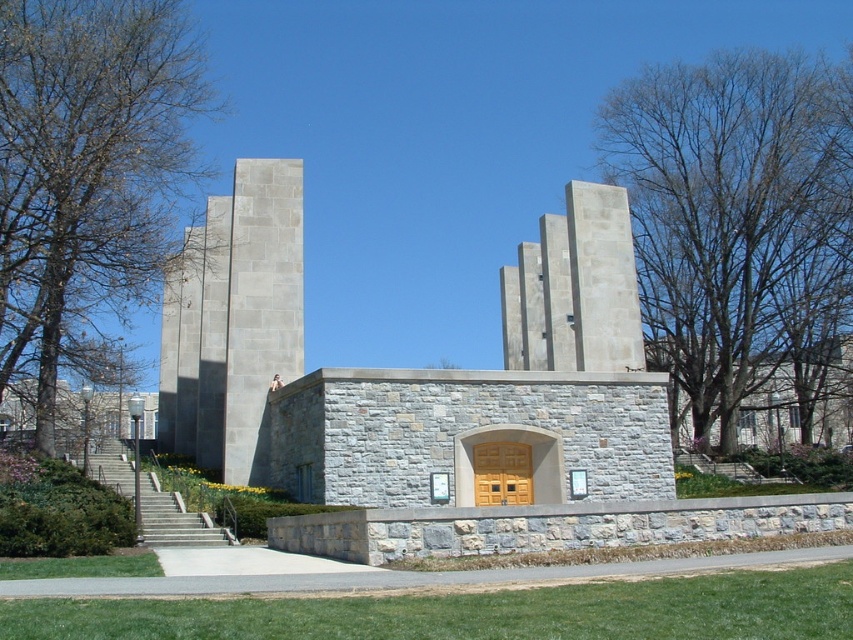
Question: Can you confirm if bare branches at right is wider than light beige stone tower at center?

Choices:
 (A) yes
 (B) no

Answer: (A)

Question: Is bare branches at right thinner than light beige stone tower at center?

Choices:
 (A) yes
 (B) no

Answer: (B)

Question: Which object is closer to the camera taking this photo?

Choices:
 (A) gray stone tower at center
 (B) light beige stone tower at center
 (C) brown leafy tree at upper left

Answer: (A)

Question: Which point appears closest to the camera in this image?

Choices:
 (A) (90, 93)
 (B) (267, 310)
 (C) (514, 316)
 (D) (685, 269)

Answer: (B)

Question: Which object is the closest to the light beige stone tower at center?

Choices:
 (A) gray stone tower at center
 (B) brown leafy tree at upper left
 (C) bare branches at right

Answer: (C)

Question: Is bare branches at right to the right of gray stone tower at center from the viewer's perspective?

Choices:
 (A) no
 (B) yes

Answer: (B)